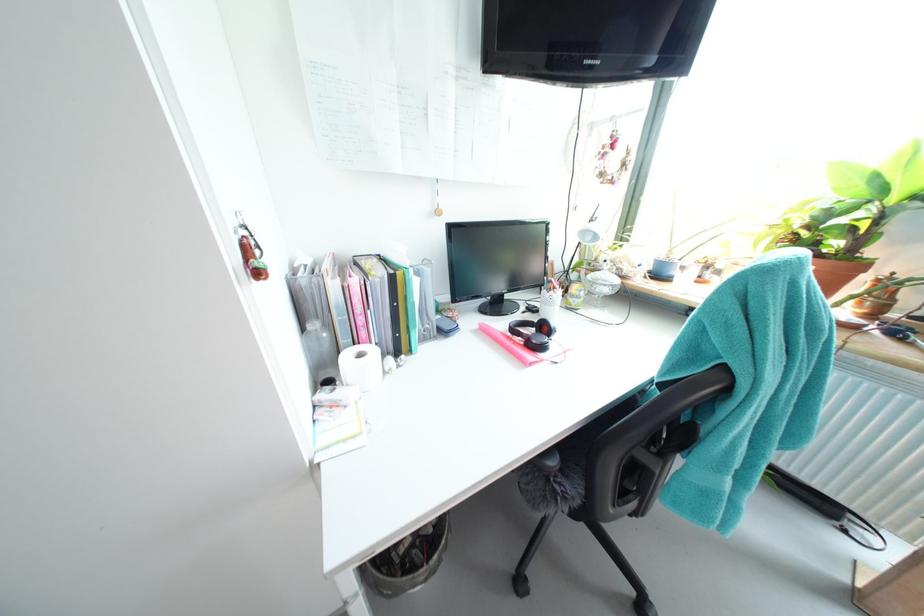
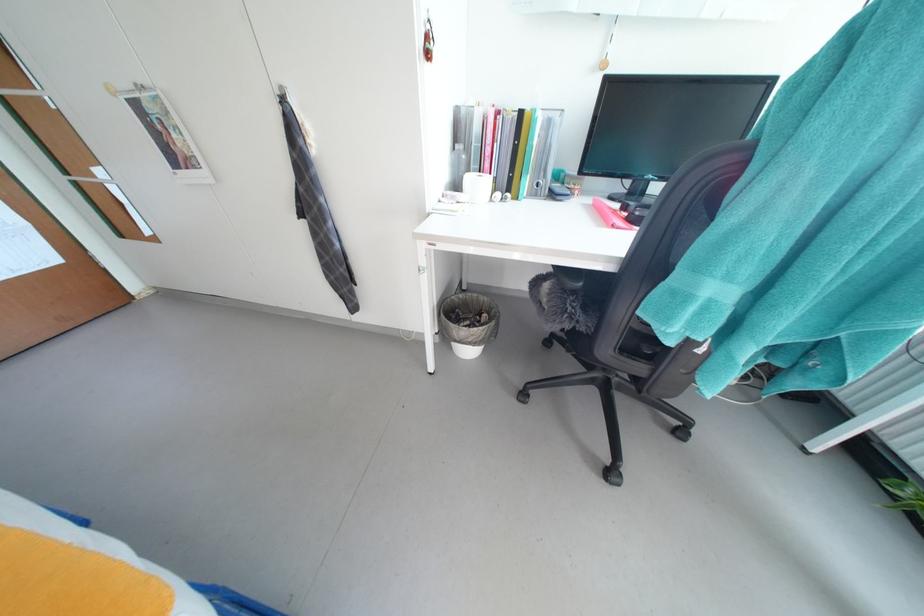
The point at (406, 342) is marked in the first image. Where is the corresponding point in the second image?

(517, 183)